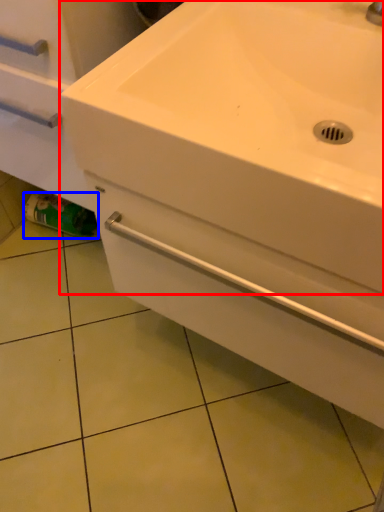
Question: Which object is closer to the camera taking this photo, sink (highlighted by a red box) or toilet paper (highlighted by a blue box)?

Choices:
 (A) sink
 (B) toilet paper

Answer: (A)